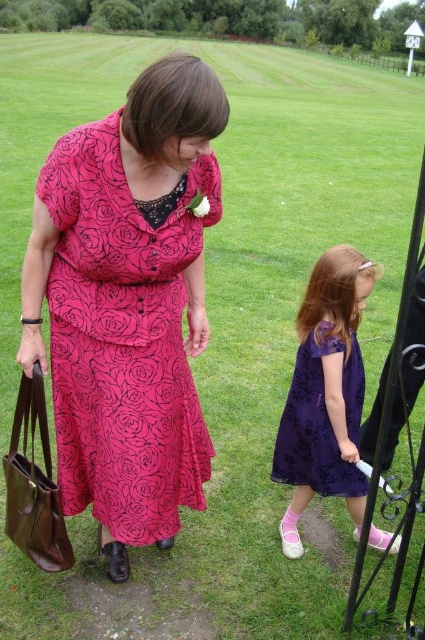
Question: Does purple satin dress at lower right appear on the right side of purple lace dress at lower right?

Choices:
 (A) no
 (B) yes

Answer: (B)

Question: Considering the real-world distances, which object is farthest from the purple lace dress at lower right?

Choices:
 (A) matte pink dress at center
 (B) purple satin dress at lower right

Answer: (A)

Question: Can you confirm if matte pink dress at center is bigger than purple satin dress at lower right?

Choices:
 (A) yes
 (B) no

Answer: (A)

Question: Considering the real-world distances, which object is closest to the purple satin dress at lower right?

Choices:
 (A) purple lace dress at lower right
 (B) matte pink dress at center

Answer: (A)

Question: Among these points, which one is nearest to the camera?

Choices:
 (A) (302, 396)
 (B) (81, 342)

Answer: (B)

Question: Is matte pink dress at center positioned behind purple satin dress at lower right?

Choices:
 (A) no
 (B) yes

Answer: (A)